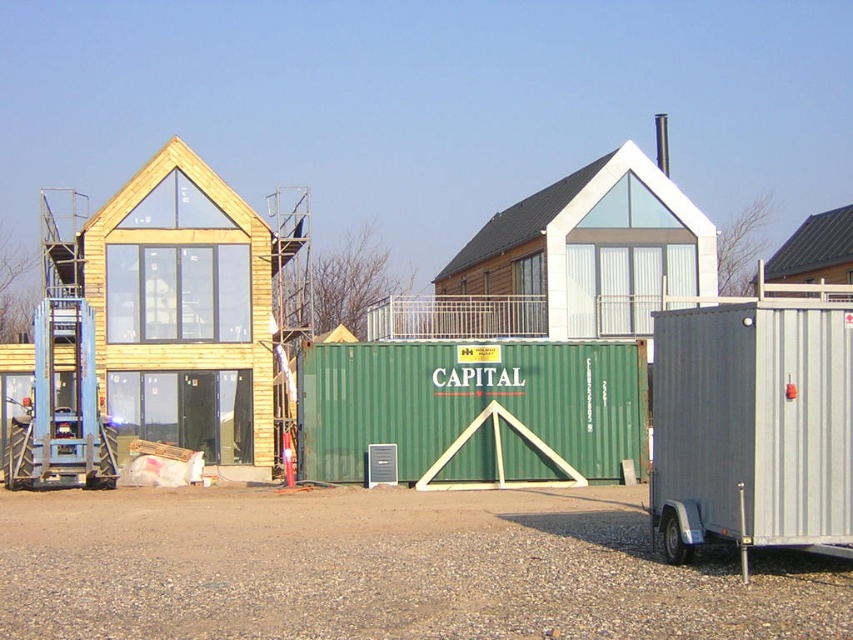
Question: Does white matte wooden hut at center appear on the left side of brown wooden hut at upper right?

Choices:
 (A) no
 (B) yes

Answer: (B)

Question: Does wooden house at left appear on the left side of brown wooden hut at upper right?

Choices:
 (A) yes
 (B) no

Answer: (A)

Question: Is wooden house at left above brown wooden hut at upper right?

Choices:
 (A) no
 (B) yes

Answer: (B)

Question: Considering the real-world distances, which object is closest to the white matte wooden hut at center?

Choices:
 (A) wooden house at left
 (B) brown wooden hut at upper right
 (C) gray metallic trailer at right
 (D) green matte shipping container at center

Answer: (A)

Question: Estimate the real-world distances between objects in this image. Which object is farther from the wooden house at left?

Choices:
 (A) brown wooden hut at upper right
 (B) gray metallic trailer at right

Answer: (B)

Question: Which of the following is the closest to the observer?

Choices:
 (A) white matte wooden hut at center
 (B) gray metallic trailer at right
 (C) green matte shipping container at center

Answer: (B)